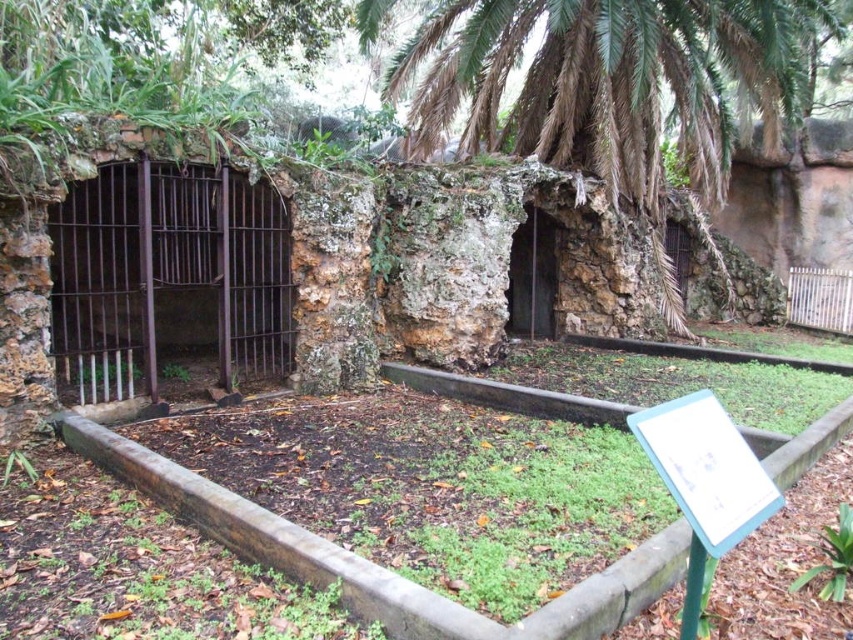
Which of these two, rusty metal cage at left or green plastic sign at lower right, stands shorter?

With less height is green plastic sign at lower right.

Can you confirm if rusty metal cage at left is positioned above green plastic sign at lower right?

Yes, rusty metal cage at left is above green plastic sign at lower right.

Does point (173, 257) come farther from viewer compared to point (709, 467)?

Yes, it is.

Locate an element on the screen. The width and height of the screenshot is (853, 640). rusty metal cage at left is located at coordinates (167, 282).

Can you confirm if green leafy palm tree at center is positioned above green plastic sign at lower right?

Correct, green leafy palm tree at center is located above green plastic sign at lower right.

Is green leafy palm tree at center wider than green plastic sign at lower right?

Yes, green leafy palm tree at center is wider than green plastic sign at lower right.

Who is more forward, (467,60) or (688,476)?

Point (688,476) is in front.

Where is `green leafy palm tree at center`? The height and width of the screenshot is (640, 853). green leafy palm tree at center is located at coordinates (613, 83).

Does green leafy palm tree at center have a lesser height compared to rusty metal cage at left?

No, green leafy palm tree at center is not shorter than rusty metal cage at left.

Between green leafy palm tree at center and rusty metal cage at left, which one has less height?

rusty metal cage at left

This screenshot has height=640, width=853. I want to click on green leafy palm tree at center, so click(x=613, y=83).